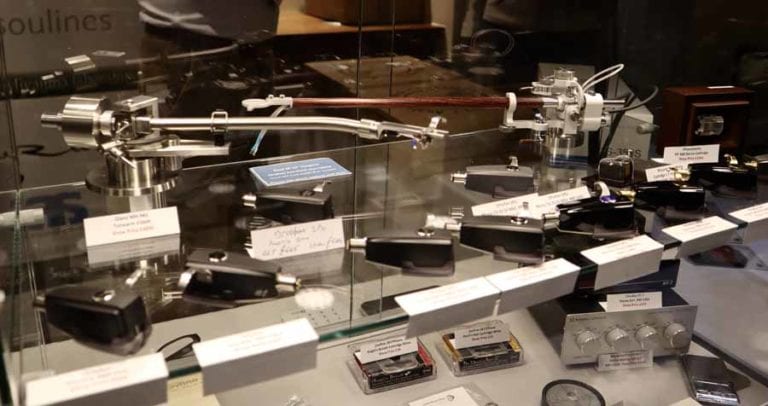
You are a GUI agent. You are given a task and a screenshot of the screen. Output one action in this format:
    pyautogui.click(x=<x>, y=<y>)
    Task: Click on the second from left dial
    
    Given the screenshot: What is the action you would take?
    pyautogui.click(x=618, y=341)